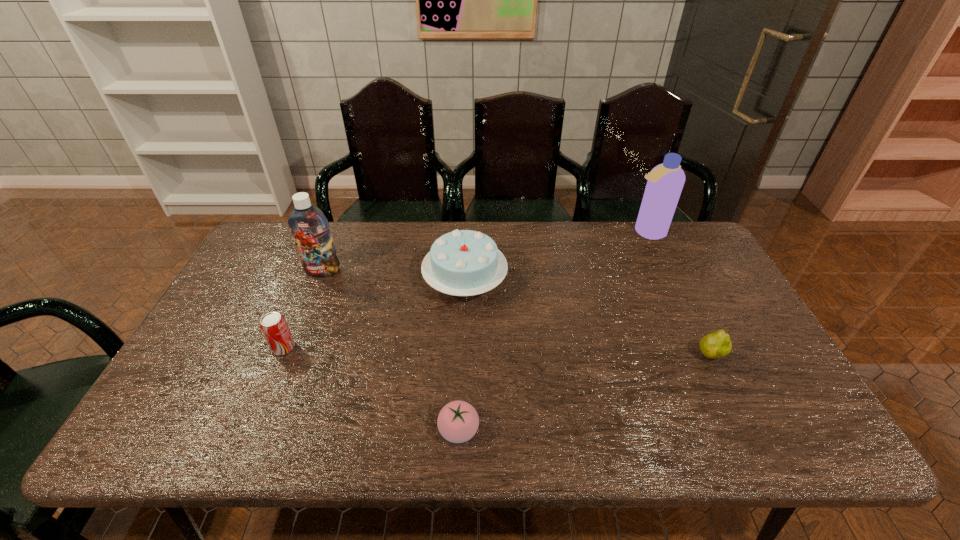
I want to click on object identified as the closest to the shortest object, so click(715, 243).

Choose which object is the nearest neighbor to the pumpkin. Please provide its 2D coordinates. Your answer should be formatted as a tuple, i.e. [(x, y)], where the tuple contains the x and y coordinates of a point satisfying the conditions above.

[(492, 298)]

At what (x,y) coordinates should I click in order to perform the action: click on detergent that stands as the second closest to the leftmost white detergent. Please return your answer as a coordinate pair (x, y). The width and height of the screenshot is (960, 540). Looking at the image, I should click on point(419,188).

The height and width of the screenshot is (540, 960). I want to click on detergent that is the second nearest to the biggest white detergent, so click(x=549, y=204).

Locate an element on the screen. Image resolution: width=960 pixels, height=540 pixels. red detergent identified as the second closest to the leftmost red detergent is located at coordinates (419, 188).

Select which red detergent appears as the closest to the rightmost red detergent. Please provide its 2D coordinates. Your answer should be formatted as a tuple, i.e. [(x, y)], where the tuple contains the x and y coordinates of a point satisfying the conditions above.

[(492, 298)]

Where is `white detergent that can be found as the second closest to the biggest white detergent`? The height and width of the screenshot is (540, 960). white detergent that can be found as the second closest to the biggest white detergent is located at coordinates tap(234, 248).

Choose which white detergent is the nearest neighbor to the biggest white detergent. Please provide its 2D coordinates. Your answer should be formatted as a tuple, i.e. [(x, y)], where the tuple contains the x and y coordinates of a point satisfying the conditions above.

[(786, 342)]

You are a GUI agent. You are given a task and a screenshot of the screen. Output one action in this format:
    pyautogui.click(x=<x>, y=<y>)
    Task: Click on the free location that satisfies the following two spatial constraints: 1. on the front surface of the smallest white detergent; 2. on the right side of the fourth object from right to left
    The height and width of the screenshot is (540, 960).
    Given the screenshot: What is the action you would take?
    pyautogui.click(x=567, y=357)

Where is `vacant area in the image that satisfies the following two spatial constraints: 1. on the front side of the nearest white detergent; 2. on the right side of the pumpkin`? This screenshot has height=540, width=960. vacant area in the image that satisfies the following two spatial constraints: 1. on the front side of the nearest white detergent; 2. on the right side of the pumpkin is located at coordinates (351, 357).